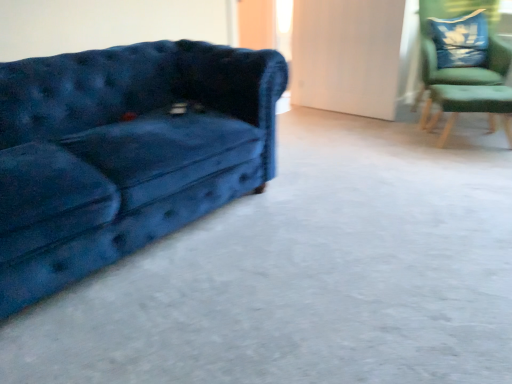
Question: Is velvet blue couch at left far from green fabric chair at upper right?

Choices:
 (A) yes
 (B) no

Answer: (A)

Question: Can you confirm if velvet blue couch at left is thinner than green fabric chair at upper right?

Choices:
 (A) no
 (B) yes

Answer: (A)

Question: From the image's perspective, is velvet blue couch at left located beneath green fabric chair at upper right?

Choices:
 (A) yes
 (B) no

Answer: (A)

Question: From the image's perspective, is velvet blue couch at left on green fabric chair at upper right?

Choices:
 (A) yes
 (B) no

Answer: (B)

Question: Is velvet blue couch at left outside green fabric chair at upper right?

Choices:
 (A) yes
 (B) no

Answer: (A)

Question: Do you think green fabric chair at upper right is within velvet blue couch at left, or outside of it?

Choices:
 (A) inside
 (B) outside

Answer: (B)

Question: Is point (460, 3) closer or farther from the camera than point (65, 105)?

Choices:
 (A) closer
 (B) farther

Answer: (B)

Question: From the image's perspective, is green fabric chair at upper right located above or below velvet blue couch at left?

Choices:
 (A) above
 (B) below

Answer: (A)

Question: Based on their sizes in the image, would you say green fabric chair at upper right is bigger or smaller than velvet blue couch at left?

Choices:
 (A) small
 (B) big

Answer: (A)

Question: Is velvet blue couch at left taller or shorter than velvet blue pillow at upper right?

Choices:
 (A) short
 (B) tall

Answer: (B)

Question: Considering the relative positions of velvet blue couch at left and velvet blue pillow at upper right in the image provided, is velvet blue couch at left to the left or to the right of velvet blue pillow at upper right?

Choices:
 (A) left
 (B) right

Answer: (A)

Question: From a real-world perspective, relative to velvet blue pillow at upper right, is velvet blue couch at left vertically above or below?

Choices:
 (A) below
 (B) above

Answer: (A)

Question: Is point (140, 114) positioned closer to the camera than point (472, 29)?

Choices:
 (A) farther
 (B) closer

Answer: (B)

Question: Is green fabric side table at right to the left or to the right of blue velvet couch at left in the image?

Choices:
 (A) right
 (B) left

Answer: (A)

Question: Looking at the image, does green fabric side table at right seem bigger or smaller compared to blue velvet couch at left?

Choices:
 (A) big
 (B) small

Answer: (B)